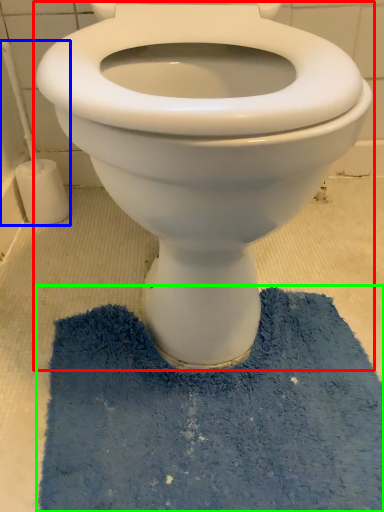
Question: Which is nearer to the toilet (highlighted by a red box)? brush (highlighted by a blue box) or bath mat (highlighted by a green box).

Choices:
 (A) brush
 (B) bath mat

Answer: (B)